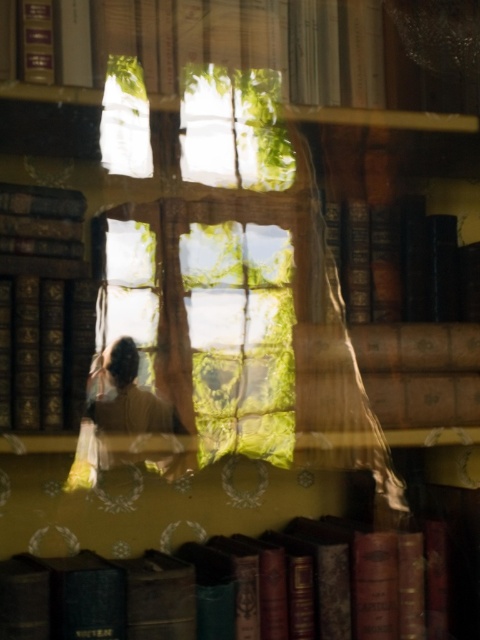
You are organizing a bookshelf and need to place the dark brown leather book at lower center and the hardcover book at center. Which book should you place first if you want to place the larger one on the bottom shelf?

The dark brown leather book at lower center is bigger than the hardcover book at center, so you should place the dark brown leather book at lower center first on the bottom shelf.

You are organizing books on a shelf. You have a dark brown leather book at lower center and a hardcover book at left. Which book is wider?

The dark brown leather book at lower center is wider than the hardcover book at left.

Looking at this image, you are organizing a bookshelf and need to place the dark brown leather book at lower center and the matte gold book at upper center. Which book should you place on the lower shelf to ensure it doesn

The dark brown leather book at lower center has a lesser height compared to the matte gold book at upper center, so it should be placed on the lower shelf to accommodate its smaller size.